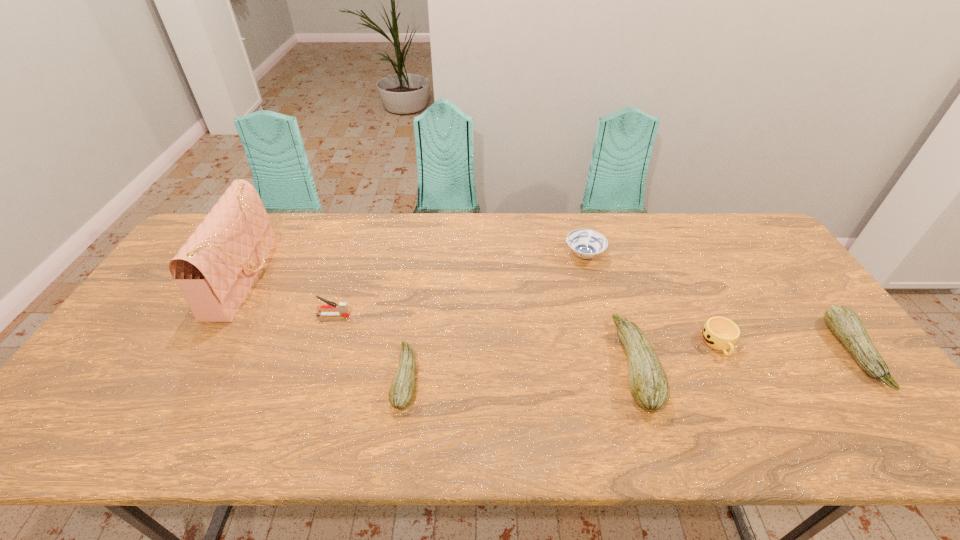
Image resolution: width=960 pixels, height=540 pixels. I want to click on soup bowl positioned at the far edge, so click(585, 243).

Where is `handbag that is at the far edge`? This screenshot has height=540, width=960. handbag that is at the far edge is located at coordinates (216, 267).

The width and height of the screenshot is (960, 540). I want to click on object positioned at the right edge, so click(844, 323).

Find the location of `object located in the near right corner section of the desktop`. object located in the near right corner section of the desktop is located at coordinates (844, 323).

Locate an element on the screen. The image size is (960, 540). vacant space at the far edge of the desktop is located at coordinates (485, 247).

Find the location of a particular element. vacant space at the near edge of the desktop is located at coordinates (751, 406).

Find the location of a particular element. Image resolution: width=960 pixels, height=540 pixels. free space at the right edge of the desktop is located at coordinates (821, 319).

Where is `vacant region at the near left corner of the desktop`? The width and height of the screenshot is (960, 540). vacant region at the near left corner of the desktop is located at coordinates (120, 384).

The image size is (960, 540). I want to click on vacant space that's between the cup and the tallest object, so click(x=483, y=310).

Find the location of a particular element. The width and height of the screenshot is (960, 540). vacant area that lies between the second tallest zucchini and the tallest object is located at coordinates tap(550, 314).